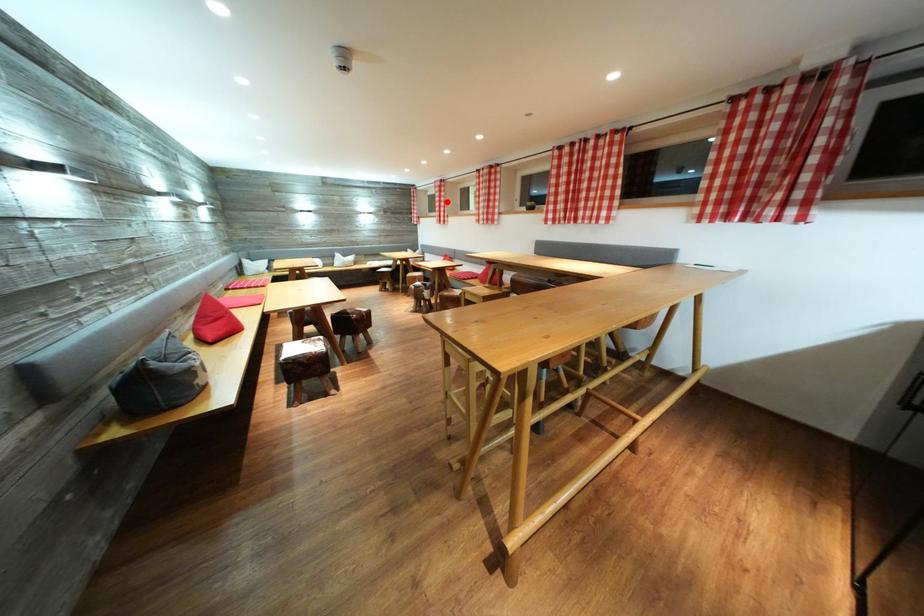
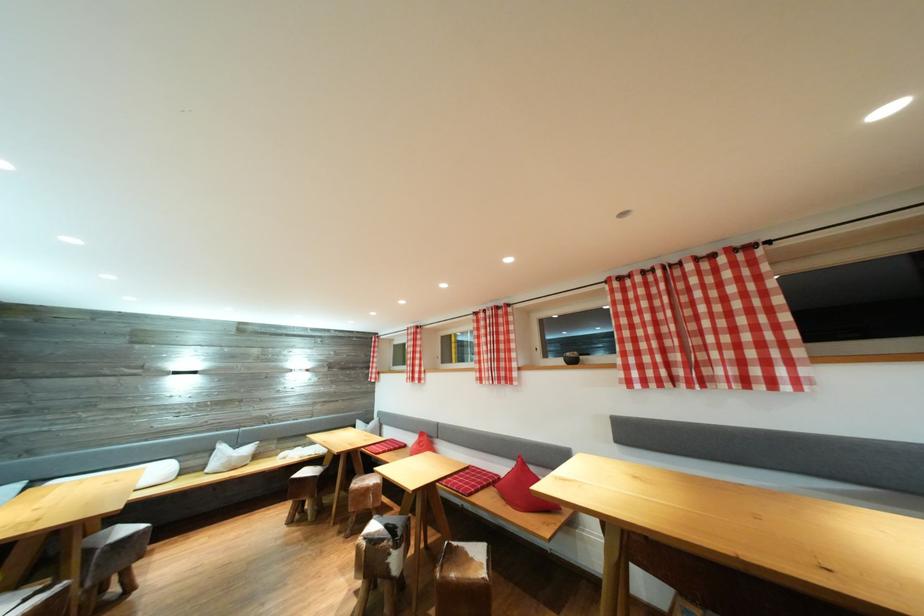
In the second image, find the point that corresponds to the highlighted location in the first image.

(421, 351)